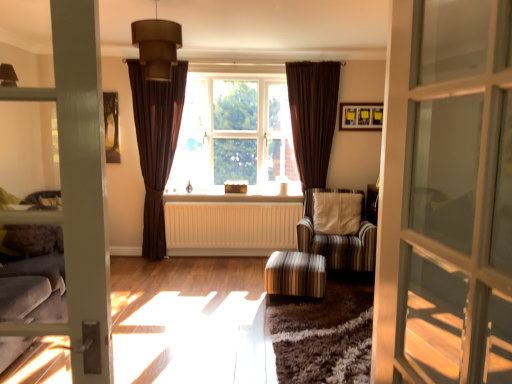
Question: In terms of height, does brown textured curtain at center, which ranks as the 2th curtain in right-to-left order, look taller or shorter compared to white painted wood at center?

Choices:
 (A) short
 (B) tall

Answer: (B)

Question: From a real-world perspective, is brown textured curtain at center, which ranks as the 2th curtain in right-to-left order, above or below white painted wood at center?

Choices:
 (A) below
 (B) above

Answer: (B)

Question: Considering the real-world distances, which object is farthest from the striped fabric armchair at center?

Choices:
 (A) brown fabric lampshade at upper center
 (B) matte glass door at right
 (C) white textured radiator at center
 (D) striped fabric stool at lower center
 (E) brown fabric window at center

Answer: (B)

Question: Estimate the real-world distances between objects in this image. Which object is closer to the white textured radiator at center?

Choices:
 (A) brown fabric lampshade at upper center
 (B) striped fabric armchair at center
 (C) matte black picture frame at upper right
 (D) striped fabric stool at lower center
 (E) white painted wood at center

Answer: (E)